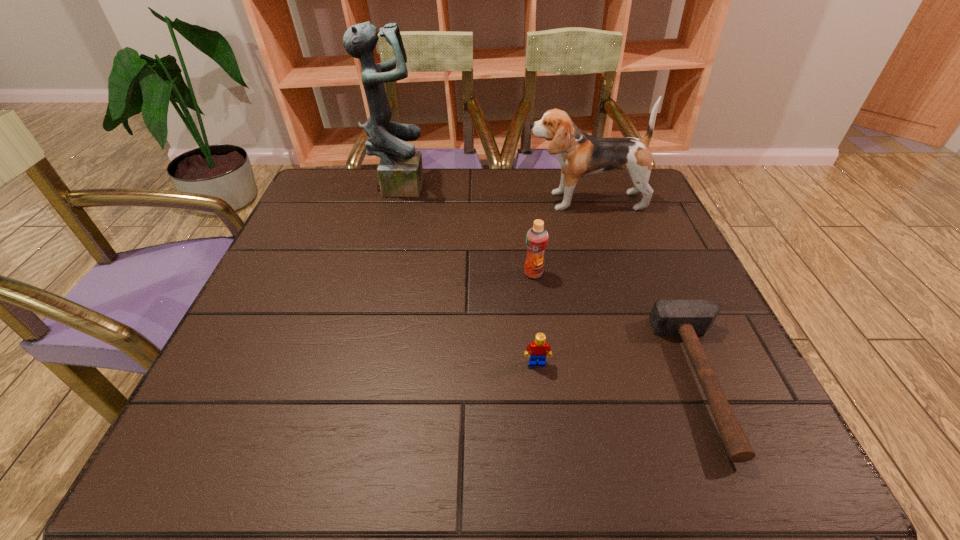
The image size is (960, 540). What are the coordinates of `free space located 0.110m at the face of the puppy` in the screenshot? It's located at (484, 201).

The image size is (960, 540). In order to click on free space located 0.150m on the back of the third nearest object in this screenshot , I will do `click(527, 227)`.

Where is `vacant area located on the front-facing side of the fourth tallest object`? The width and height of the screenshot is (960, 540). vacant area located on the front-facing side of the fourth tallest object is located at coordinates (540, 396).

Where is `free space located 0.320m on the striking surface of the shortest object`? free space located 0.320m on the striking surface of the shortest object is located at coordinates (492, 381).

You are a GUI agent. You are given a task and a screenshot of the screen. Output one action in this format:
    pyautogui.click(x=<x>, y=<y>)
    Task: Click on the vacant space located 0.280m on the striking surface of the shortest object
    Image resolution: width=960 pixels, height=540 pixels.
    Given the screenshot: What is the action you would take?
    pyautogui.click(x=515, y=381)

You are a GUI agent. You are given a task and a screenshot of the screen. Output one action in this format:
    pyautogui.click(x=<x>, y=<y>)
    Task: Click on the vacant space located on the striking surface of the shortest object
    The height and width of the screenshot is (540, 960).
    Given the screenshot: What is the action you would take?
    pyautogui.click(x=592, y=381)

Where is `sculpture that is at the far edge`? sculpture that is at the far edge is located at coordinates (400, 172).

You are a GUI agent. You are given a task and a screenshot of the screen. Output one action in this format:
    pyautogui.click(x=<x>, y=<y>)
    Task: Click on the puppy located at the far edge
    Image resolution: width=960 pixels, height=540 pixels.
    Given the screenshot: What is the action you would take?
    pyautogui.click(x=580, y=155)

Identify the location of object at the near edge. The height and width of the screenshot is (540, 960). (687, 318).

Locate an element on the screen. The height and width of the screenshot is (540, 960). puppy at the right edge is located at coordinates (580, 155).